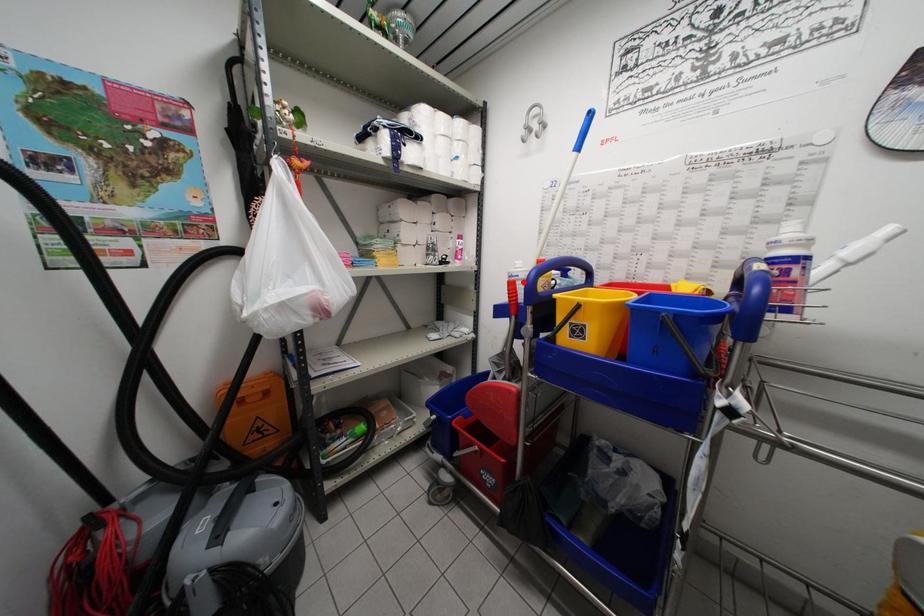
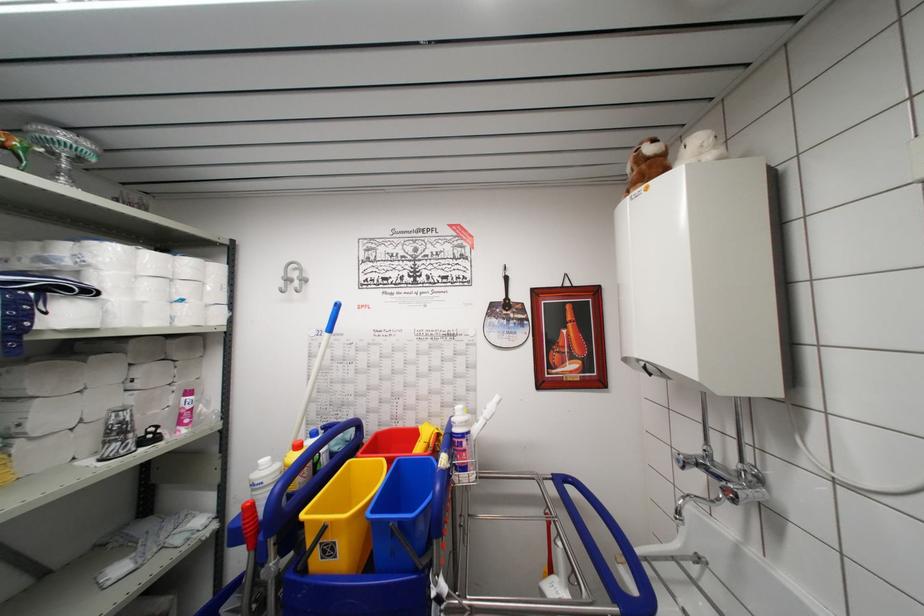
Question: I am providing you with two images of the same scene from different viewpoints. A red point is marked on the first image. Is the red point's position out of view in image 2?

Choices:
 (A) Yes
 (B) No

Answer: (B)